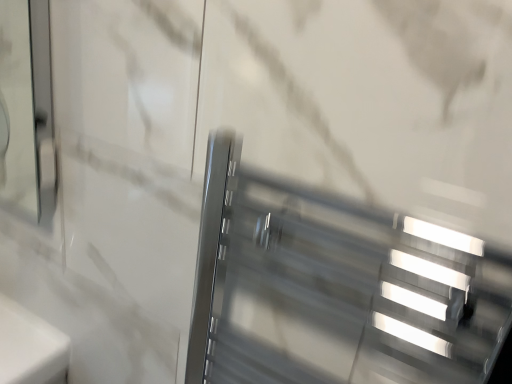
The height and width of the screenshot is (384, 512). Describe the element at coordinates (335, 288) in the screenshot. I see `satin silver screen door at center` at that location.

Locate an element on the screen. This screenshot has height=384, width=512. satin silver screen door at center is located at coordinates (335, 288).

Measure the distance between point (x=262, y=174) and camera.

Point (x=262, y=174) is 22.20 inches from camera.

You are a GUI agent. You are given a task and a screenshot of the screen. Output one action in this format:
    pyautogui.click(x=<x>, y=<y>)
    Task: Click on the satin silver screen door at center
    The height and width of the screenshot is (384, 512).
    Given the screenshot: What is the action you would take?
    click(x=335, y=288)